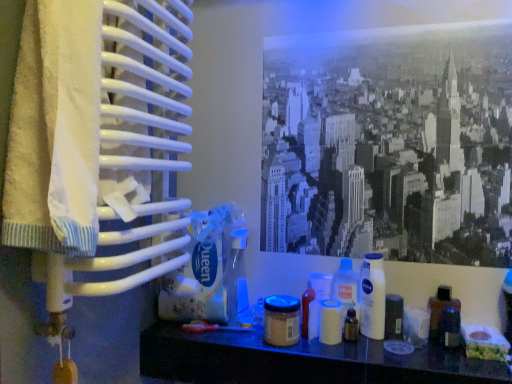
At what (x,y) coordinates should I click in order to perform the action: click on free space in front of white plastic jar at center, the 5th toiletry when ordered from left to right. Please return your answer as a coordinate pair (x, y). The width and height of the screenshot is (512, 384). Looking at the image, I should click on (340, 359).